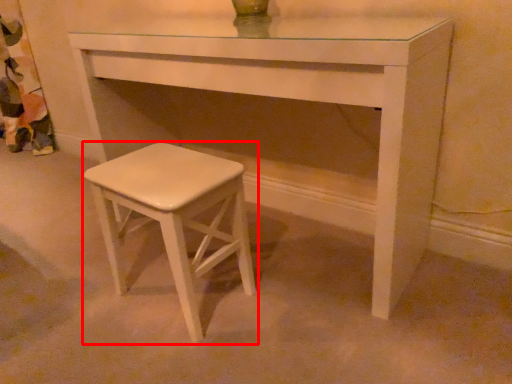
Question: Where is stool (annotated by the red box) located in relation to table in the image?

Choices:
 (A) right
 (B) left

Answer: (B)